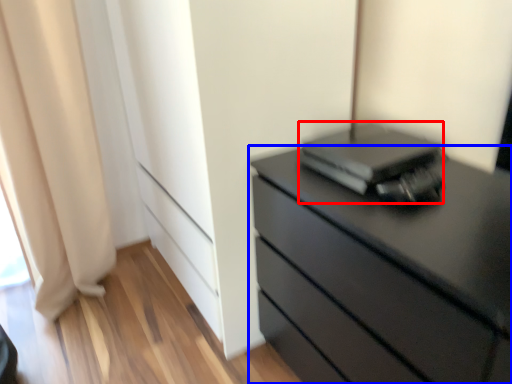
Question: Which point is further to the camera, computer (highlighted by a red box) or chest of drawers (highlighted by a blue box)?

Choices:
 (A) computer
 (B) chest of drawers

Answer: (A)